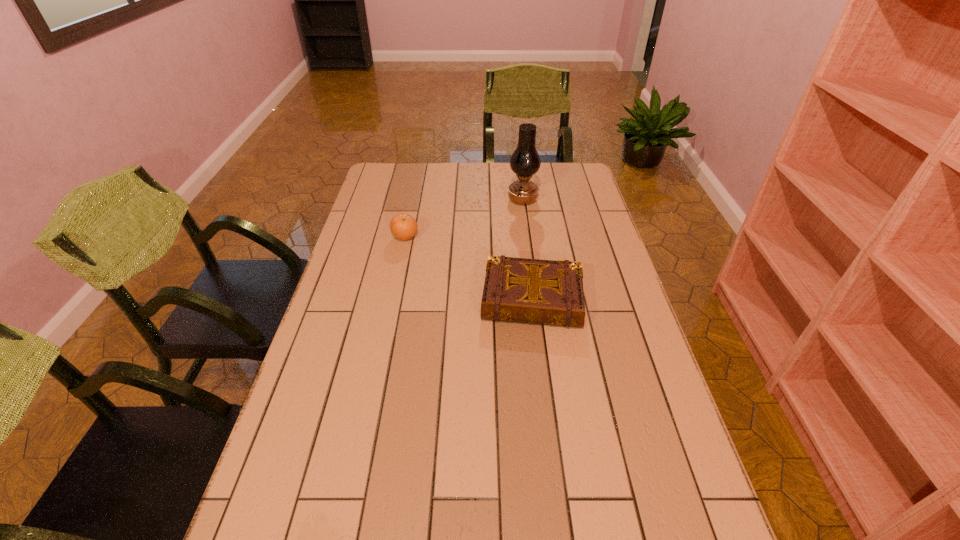
Find the location of `object that is positioned at the right edge`. object that is positioned at the right edge is located at coordinates (548, 292).

Locate an element on the screen. free spot at the far edge of the desktop is located at coordinates (443, 191).

In the image, there is a desktop. What are the coordinates of `vacant space at the left edge` in the screenshot? It's located at (307, 356).

The width and height of the screenshot is (960, 540). Identify the location of vacant space at the right edge of the desktop. (571, 242).

At what (x,y) coordinates should I click in order to perform the action: click on vacant region at the far right corner of the desktop. Please return your answer as a coordinate pair (x, y). The width and height of the screenshot is (960, 540). Looking at the image, I should click on (562, 183).

Image resolution: width=960 pixels, height=540 pixels. What are the coordinates of `free spot between the leftmost object and the hardback book` in the screenshot? It's located at (x=468, y=268).

In order to click on unoccupied area between the nearest object and the oil lamp in this screenshot , I will do `click(527, 249)`.

This screenshot has width=960, height=540. I want to click on vacant region between the shortest object and the orange, so click(468, 268).

The height and width of the screenshot is (540, 960). Identify the location of free space that is in between the second shortest object and the farthest object. (464, 218).

At what (x,y) coordinates should I click in order to perform the action: click on free spot between the leftmost object and the tallest object. Please return your answer as a coordinate pair (x, y). The height and width of the screenshot is (540, 960). Looking at the image, I should click on (464, 218).